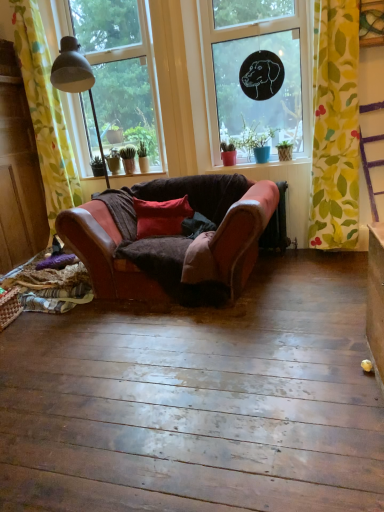
Question: From the image's perspective, is yellow floral fabric at left, which is the 2th curtain in right-to-left order, above or below yellow floral fabric at right, which appears as the first curtain when viewed from the right?

Choices:
 (A) above
 (B) below

Answer: (A)

Question: Is yellow floral fabric at left, which is the first curtain in left-to-right order, situated inside yellow floral fabric at right, positioned as the second curtain in left-to-right order, or outside?

Choices:
 (A) outside
 (B) inside

Answer: (A)

Question: Which object is positioned closest to the leather couch at center?

Choices:
 (A) green fabric at lower left
 (B) transparent glass window at upper left, the first window positioned from the left
 (C) matte red cushion at center
 (D) yellow floral fabric at right, positioned as the second curtain in left-to-right order
 (E) matte red pot at center

Answer: (C)

Question: Which object is positioned farthest from the yellow floral fabric at left, which is the first curtain in left-to-right order?

Choices:
 (A) transparent glass window at upper center, the 1th window when ordered from right to left
 (B) green fabric at lower left
 (C) matte red pot at center
 (D) leather couch at center
 (E) transparent glass window at upper left, which ranks as the 2th window in right-to-left order

Answer: (A)